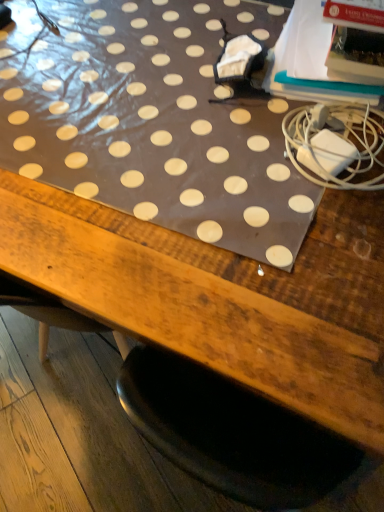
What do you see at coordinates (337, 144) in the screenshot? Image resolution: width=384 pixels, height=512 pixels. I see `white matte cable at upper right` at bounding box center [337, 144].

The height and width of the screenshot is (512, 384). What are the coordinates of `white matte cable at upper right` in the screenshot? It's located at (337, 144).

The image size is (384, 512). What are the coordinates of `white matte cable at upper right` in the screenshot? It's located at (337, 144).